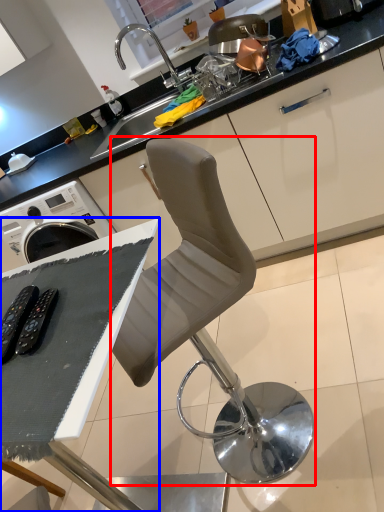
Question: Which object is further to the camera taking this photo, chair (highlighted by a red box) or table (highlighted by a blue box)?

Choices:
 (A) chair
 (B) table

Answer: (A)